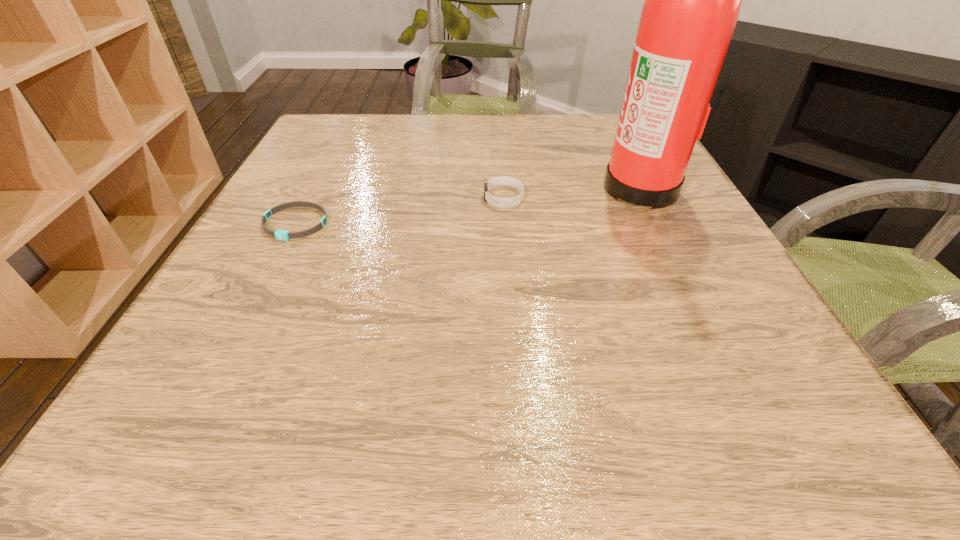
I want to click on free spot located on the outer surface of the taller wristband, so click(326, 198).

Find the location of `vacant space located 0.310m on the outer surface of the taller wristband`. vacant space located 0.310m on the outer surface of the taller wristband is located at coordinates (331, 198).

Identify the location of vacant space located 0.170m on the buckle of the shorter wristband. (250, 313).

The height and width of the screenshot is (540, 960). I want to click on object that is at the left edge, so click(284, 235).

The height and width of the screenshot is (540, 960). In order to click on object that is at the right edge in this screenshot , I will do `click(692, 2)`.

Where is `blank space at the far edge`? The height and width of the screenshot is (540, 960). blank space at the far edge is located at coordinates (457, 138).

The height and width of the screenshot is (540, 960). In order to click on vacant space at the left edge of the desktop in this screenshot , I will do `click(336, 190)`.

At what (x,y) coordinates should I click in order to perform the action: click on free space at the right edge of the desktop. Please return your answer as a coordinate pair (x, y). Looking at the image, I should click on (776, 356).

Locate an element on the screen. This screenshot has width=960, height=540. free space that is in between the shorter wristband and the tallest object is located at coordinates (468, 205).

Identify the location of vacant space that is in between the rightmost object and the leftmost object. (468, 205).